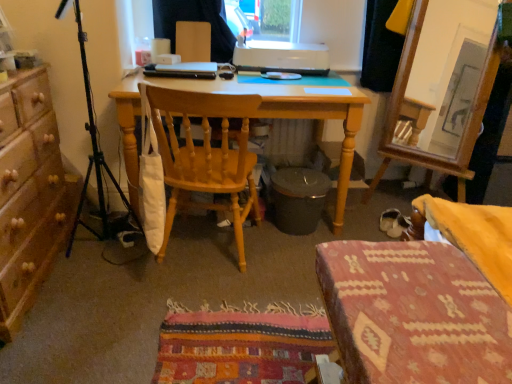
Question: Does point (102, 157) appear closer or farther from the camera than point (392, 218)?

Choices:
 (A) closer
 (B) farther

Answer: (A)

Question: Would you say black matte tripod at left is to the left or to the right of white suede shoe at lower right in the picture?

Choices:
 (A) left
 (B) right

Answer: (A)

Question: Based on their relative distances, which object is nearer to the black matte tripod at left?

Choices:
 (A) textured woolen stool at lower right
 (B) wooden chair at center
 (C) light wood desk at center
 (D) dark gray plastic trash bin/can at center
 (E) white plastic printer at upper center

Answer: (B)

Question: Which of these objects is positioned closest to the wooden chair at center?

Choices:
 (A) white plastic printer at upper center
 (B) wooden dresser at left
 (C) black matte tripod at left
 (D) textured woolen stool at lower right
 (E) light wood desk at center

Answer: (E)